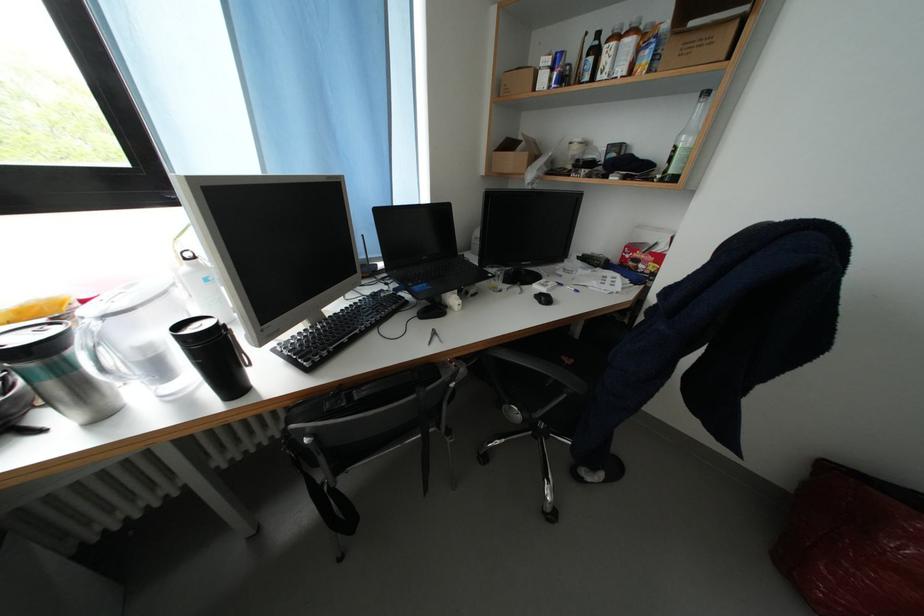
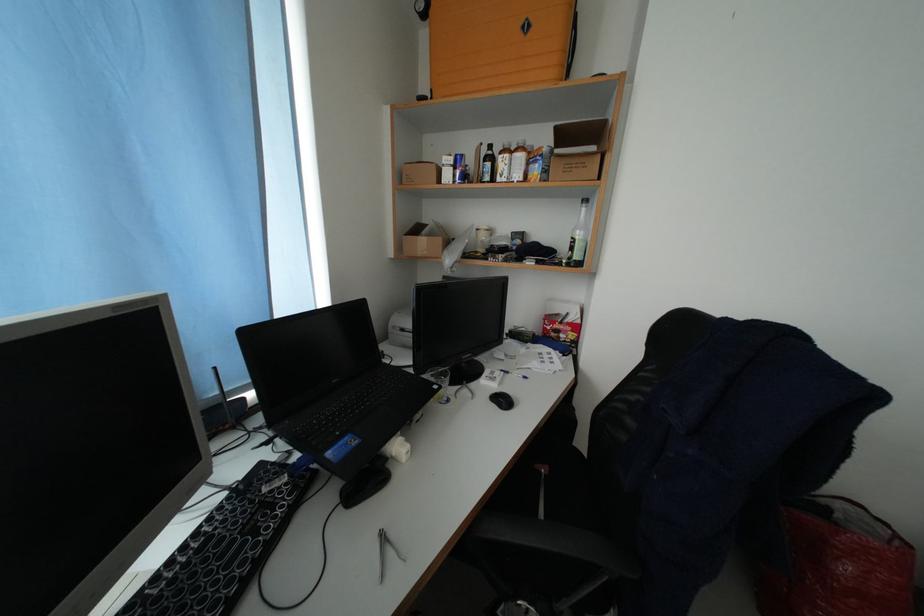
Question: I am providing you with two images of the same scene from different viewpoints. After the viewpoint changes to image2, which objects are now occluded?

Choices:
 (A) green glass bottle
 (B) black chair armrest
 (C) dark glass bottle
 (D) none of these

Answer: (D)